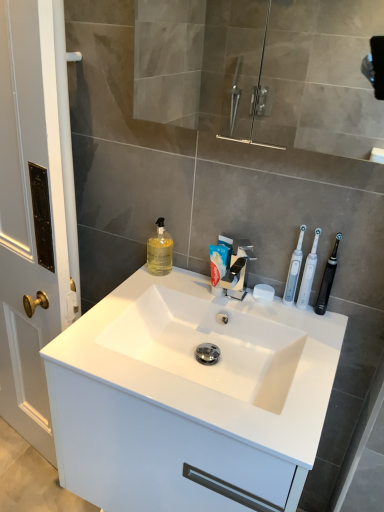
This screenshot has height=512, width=384. I want to click on free space that is in between white plastic toothbrush at right, the second toothbrush positioned from the left, and polished chrome faucet at center, so [263, 310].